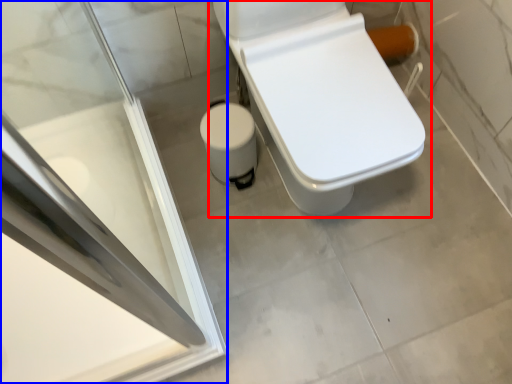
Question: Which point is closer to the camera, toilet (highlighted by a red box) or screen door (highlighted by a blue box)?

Choices:
 (A) toilet
 (B) screen door

Answer: (B)